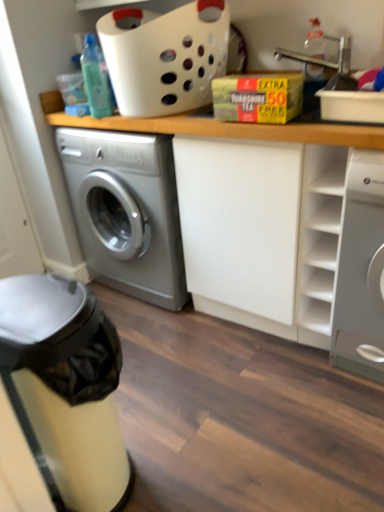
Question: From the image's perspective, is white plastic basket at upper center located above or below matte silver dishwasher at lower left?

Choices:
 (A) above
 (B) below

Answer: (A)

Question: Considering the positions of point (200, 14) and point (36, 426), is point (200, 14) closer or farther from the camera than point (36, 426)?

Choices:
 (A) closer
 (B) farther

Answer: (B)

Question: Which of these objects is positioned closest to the clear plastic bottle at upper right, positioned as the 1th bottle in right-to-left order?

Choices:
 (A) white plastic basket at upper center
 (B) translucent plastic bottle at upper left, placed as the second bottle when sorted from right to left
 (C) matte silver dishwasher at lower left
 (D) white glossy washing machine at right
 (E) wooden counter at center

Answer: (A)

Question: Which is nearer to the white plastic basket at upper center?

Choices:
 (A) white glossy washing machine at right
 (B) matte silver dishwasher at lower left
 (C) wooden counter at center
 (D) translucent plastic bottle at upper left, placed as the second bottle when sorted from right to left
 (E) clear plastic bottle at upper right, positioned as the 1th bottle in right-to-left order

Answer: (D)